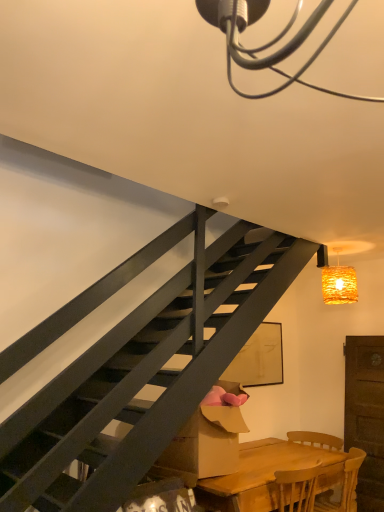
Question: Choose the correct answer: Is wooden chair at lower right inside cardboard box at lower center or outside it?

Choices:
 (A) outside
 (B) inside

Answer: (A)

Question: Is point (309, 440) closer or farther from the camera than point (215, 451)?

Choices:
 (A) farther
 (B) closer

Answer: (A)

Question: Which object is positioned closest to the wooden table at lower right?

Choices:
 (A) cardboard box at lower center
 (B) wooden chair at lower right
 (C) woven wicker lampshade at upper right

Answer: (A)

Question: Which object is the closest to the woven wicker lampshade at upper right?

Choices:
 (A) wooden table at lower right
 (B) wooden chair at lower right
 (C) cardboard box at lower center

Answer: (B)